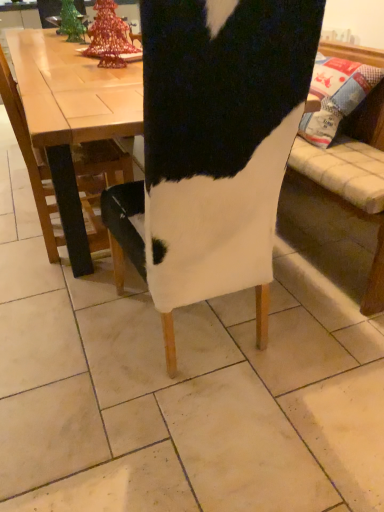
You are a GUI agent. You are given a task and a screenshot of the screen. Output one action in this format:
    pyautogui.click(x=<x>, y=<y>)
    Task: Click on the free location to the left of white fabric chair at center, the 1th chair positioned from the right
    
    Given the screenshot: What is the action you would take?
    pyautogui.click(x=66, y=334)